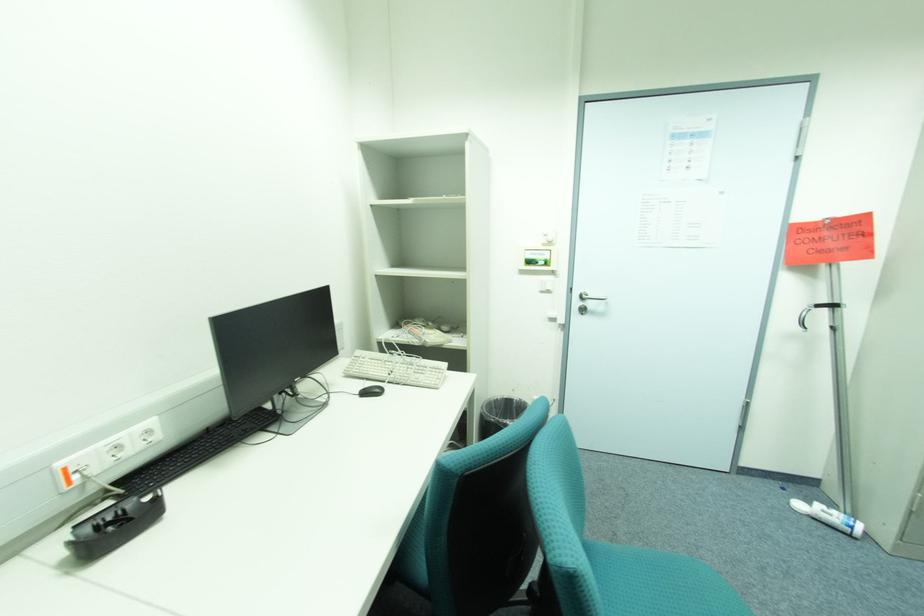
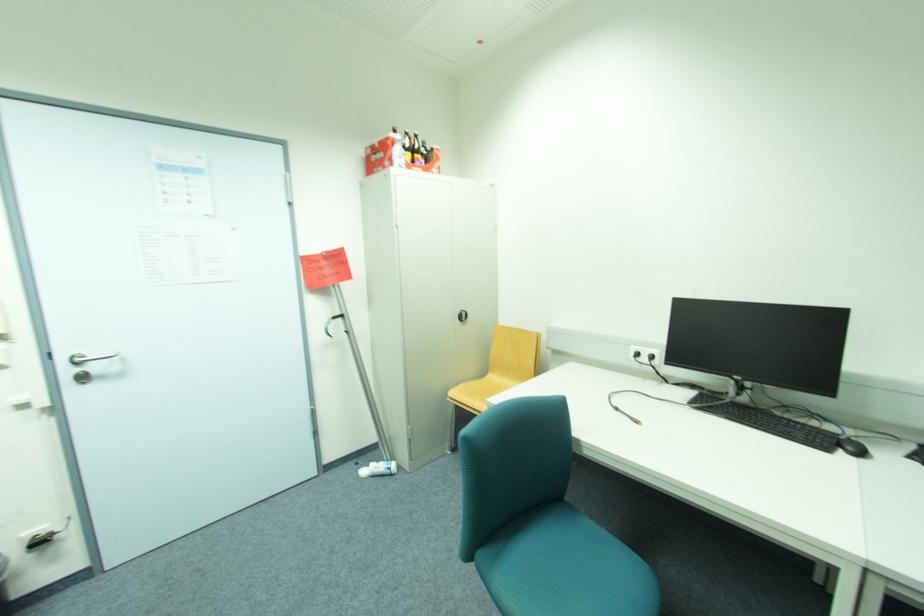
The point at (582,304) is marked in the first image. Where is the corresponding point in the second image?

(74, 371)